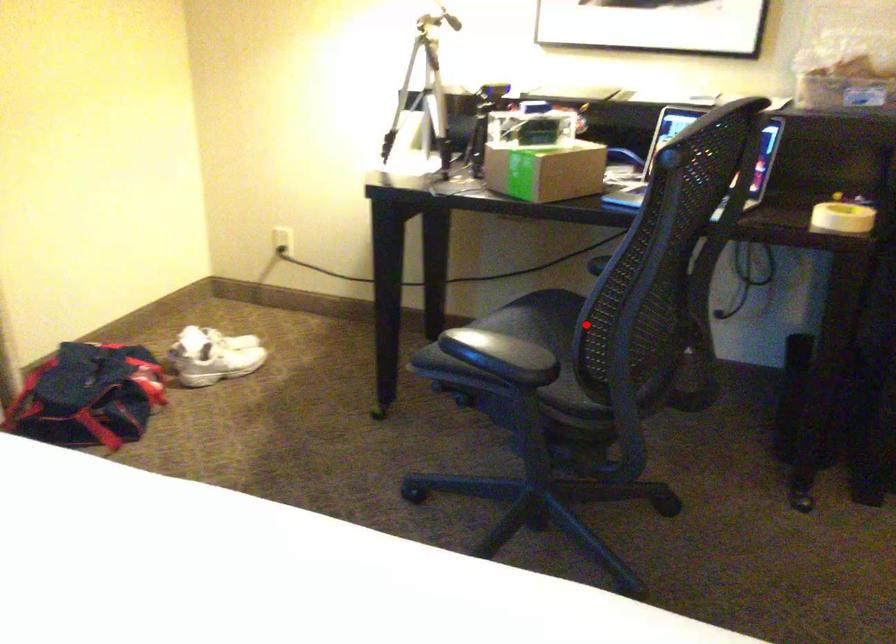
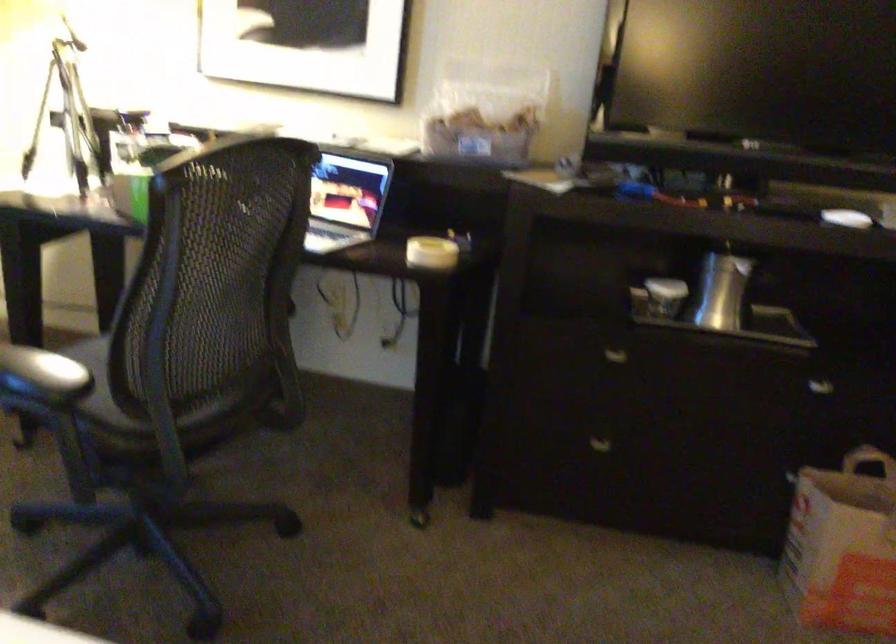
In the second image, find the point that corresponds to the highlighted location in the first image.

(124, 346)